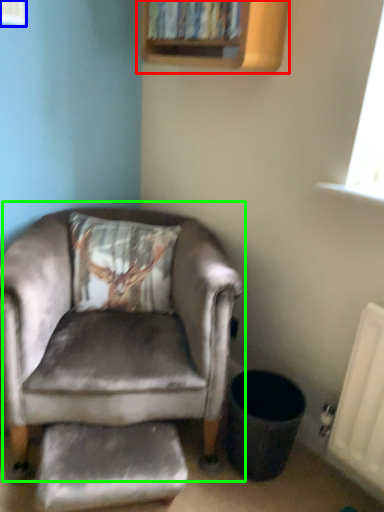
Question: Based on their relative distances, which object is nearer to bookshelf (highlighted by a red box)? Choose from window (highlighted by a blue box) and chair (highlighted by a green box).

Choices:
 (A) window
 (B) chair

Answer: (A)